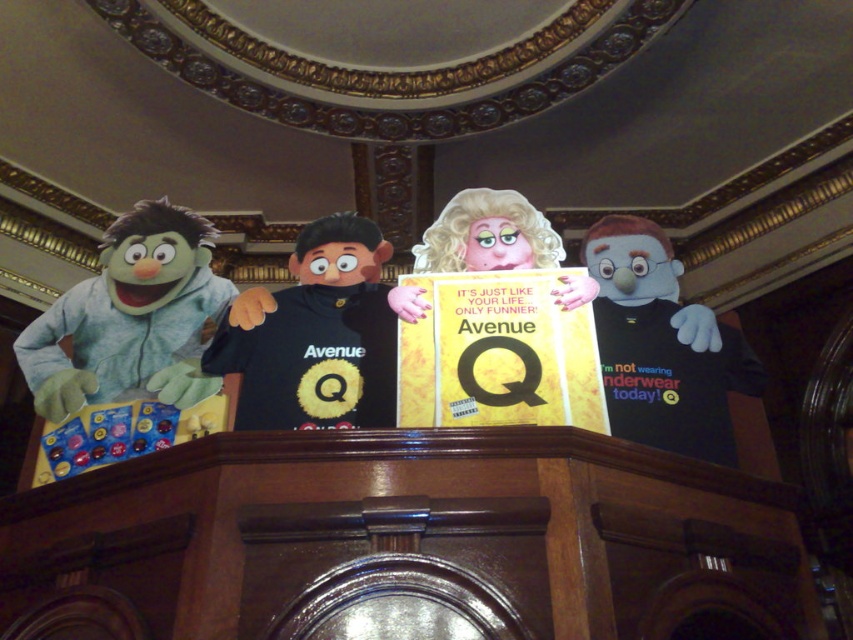
Question: From the image, what is the correct spatial relationship of black matte t-shirt at center in relation to black matte t-shirt at right?

Choices:
 (A) right
 (B) left

Answer: (B)

Question: Does black matte t-shirt at center have a smaller size compared to black matte t-shirt at right?

Choices:
 (A) yes
 (B) no

Answer: (A)

Question: Which of the following is the closest to the observer?

Choices:
 (A) (706, 364)
 (B) (131, 326)

Answer: (A)

Question: Can you confirm if black matte t-shirt at center is positioned below black matte t-shirt at right?

Choices:
 (A) no
 (B) yes

Answer: (A)

Question: Which of the following is the closest to the observer?

Choices:
 (A) (323, 372)
 (B) (73, 378)
 (C) (688, 449)

Answer: (C)

Question: Which object is the closest to the gray plush puppet at left?

Choices:
 (A) black matte t-shirt at right
 (B) black matte t-shirt at center

Answer: (B)